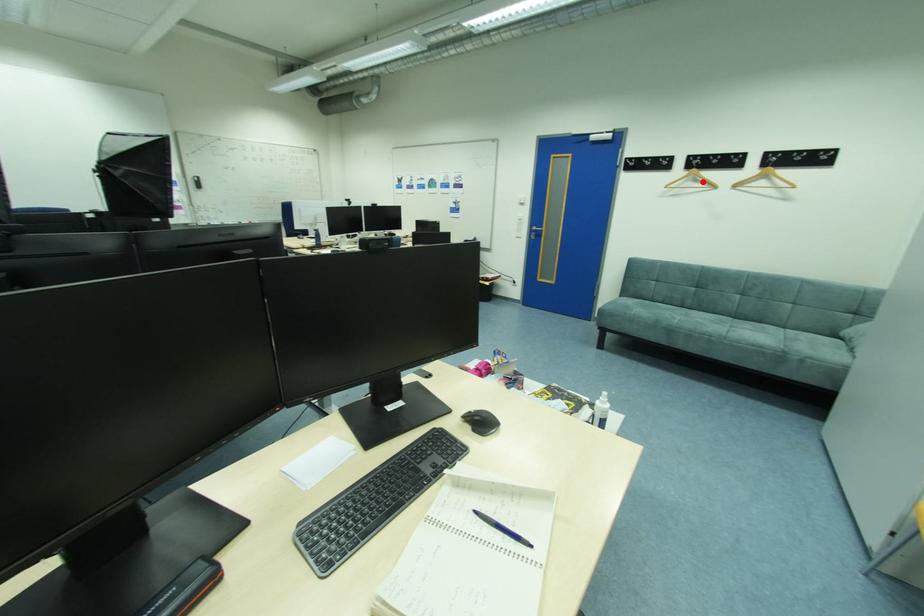
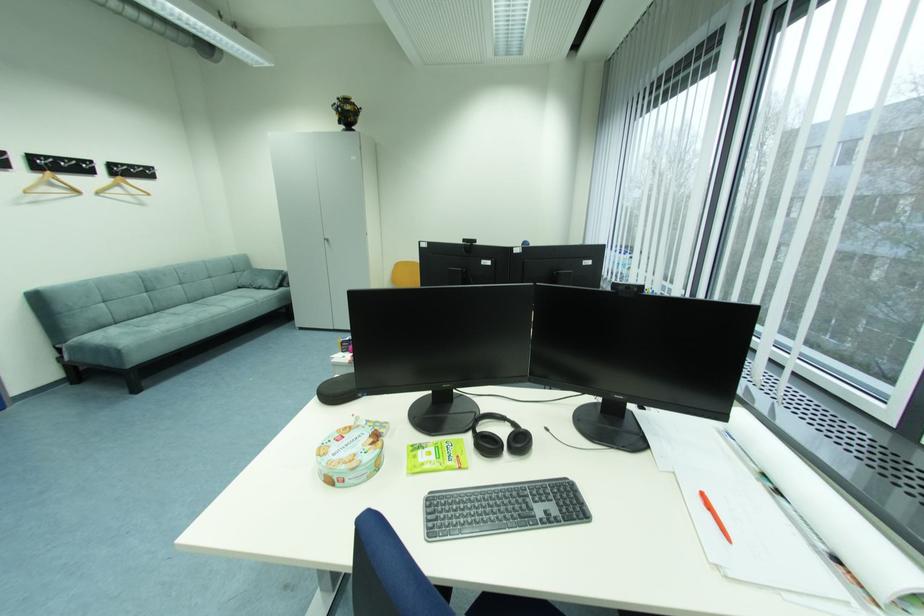
The point at the highlighted location is marked in the first image. Where is the corresponding point in the second image?

(59, 185)